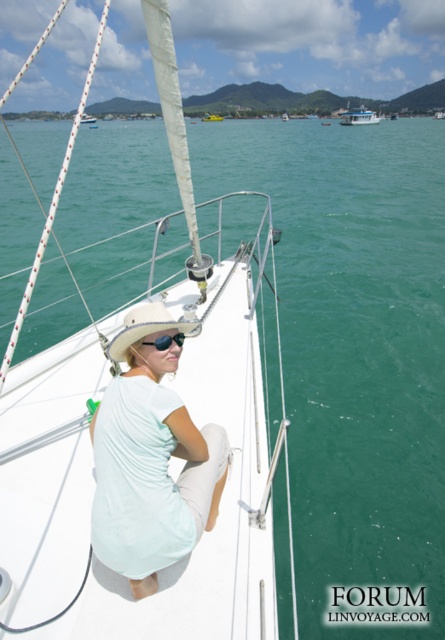
Question: Is black plastic sunglasses at center above white matte sailboat at upper left?

Choices:
 (A) no
 (B) yes

Answer: (A)

Question: Among these objects, which one is farthest from the camera?

Choices:
 (A) white matte sailboat at upper left
 (B) straw hat at center
 (C) white plastic boat at upper center
 (D) black plastic sunglasses at center

Answer: (C)

Question: Which point is closer to the camera?

Choices:
 (A) white matte boat at center
 (B) light blue fabric dress at center
 (C) white matte sailboat at upper left

Answer: (B)

Question: Does light blue fabric dress at center appear under black plastic sunglasses at center?

Choices:
 (A) no
 (B) yes

Answer: (B)

Question: Based on their relative distances, which object is farther from the white matte boat at center?

Choices:
 (A) white plastic boat at upper center
 (B) straw hat at center

Answer: (B)

Question: Is white matte sailboat at center wider than white matte sailboat at upper left?

Choices:
 (A) no
 (B) yes

Answer: (A)